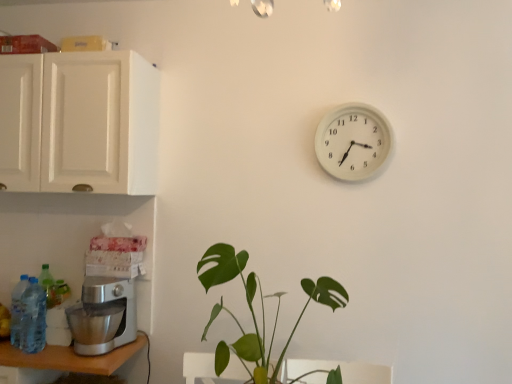
Locate an element on the screen. This screenshot has width=512, height=384. green matte plant at center is located at coordinates (254, 311).

Locate an element on the screen. The width and height of the screenshot is (512, 384). silver metallic table at lower left is located at coordinates (60, 362).

What do you see at coordinates (353, 142) in the screenshot? The width and height of the screenshot is (512, 384). I see `white plastic wall clock at upper right` at bounding box center [353, 142].

The height and width of the screenshot is (384, 512). What do you see at coordinates (33, 318) in the screenshot?
I see `blue plastic bottle at lower left, acting as the 2th bottle starting from the left` at bounding box center [33, 318].

I want to click on white matte cabinet at upper left, so click(79, 122).

Considering the sizes of objects white matte cabinet at upper left and translucent plastic bottle at lower left, the 1th bottle from the left, in the image provided, who is shorter, white matte cabinet at upper left or translucent plastic bottle at lower left, the 1th bottle from the left,?

translucent plastic bottle at lower left, the 1th bottle from the left.

Which of these two, white matte cabinet at upper left or translucent plastic bottle at lower left, positioned as the second bottle in right-to-left order, is smaller?

Smaller between the two is translucent plastic bottle at lower left, positioned as the second bottle in right-to-left order.

From the image's perspective, is white matte cabinet at upper left above or below translucent plastic bottle at lower left, positioned as the second bottle in right-to-left order?

Based on their image positions, white matte cabinet at upper left is located above translucent plastic bottle at lower left, positioned as the second bottle in right-to-left order.

Which point is more distant from viewer, (56, 59) or (24, 304)?

The point (24, 304) is farther from the camera.

From a real-world perspective, is white matte cabinet at upper left below blue plastic bottle at lower left, the 1th bottle viewed from the right?

No, from a real-world perspective, white matte cabinet at upper left is not below blue plastic bottle at lower left, the 1th bottle viewed from the right.

From the picture: Can we say white matte cabinet at upper left lies outside blue plastic bottle at lower left, acting as the 2th bottle starting from the left?

Absolutely, white matte cabinet at upper left is external to blue plastic bottle at lower left, acting as the 2th bottle starting from the left.

Is white matte cabinet at upper left looking in the opposite direction of blue plastic bottle at lower left, acting as the 2th bottle starting from the left?

No, white matte cabinet at upper left is not facing away from blue plastic bottle at lower left, acting as the 2th bottle starting from the left.

From a real-world perspective, is green matte plant at center on translucent plastic bottle at lower left, positioned as the second bottle in right-to-left order?

Correct, in the physical world, green matte plant at center is higher than translucent plastic bottle at lower left, positioned as the second bottle in right-to-left order.

In the scene shown: Relative to translucent plastic bottle at lower left, the 1th bottle from the left, is green matte plant at center in front or behind?

green matte plant at center is in front of translucent plastic bottle at lower left, the 1th bottle from the left.

Is green matte plant at center positioned with its back to translucent plastic bottle at lower left, positioned as the second bottle in right-to-left order?

No, green matte plant at center's orientation is not away from translucent plastic bottle at lower left, positioned as the second bottle in right-to-left order.

Considering the relative sizes of silver metallic table at lower left and white plastic wall clock at upper right in the image provided, is silver metallic table at lower left thinner than white plastic wall clock at upper right?

Incorrect, the width of silver metallic table at lower left is not less than that of white plastic wall clock at upper right.

Is silver metallic table at lower left next to white plastic wall clock at upper right?

No, silver metallic table at lower left is not with white plastic wall clock at upper right.

Based on the photo, considering the relative sizes of silver metallic table at lower left and white plastic wall clock at upper right in the image provided, is silver metallic table at lower left smaller than white plastic wall clock at upper right?

No.

Locate an element on the screen. This screenshot has height=384, width=512. table that appears on the left of white plastic wall clock at upper right is located at coordinates (60, 362).

From the image's perspective, which bottle is the 2nd one above the silver metallic table at lower left? Please provide its 2D coordinates.

[(17, 310)]

From the image's perspective, which object appears higher, translucent plastic bottle at lower left, the 1th bottle from the left, or silver metallic table at lower left?

translucent plastic bottle at lower left, the 1th bottle from the left.

Looking at their sizes, would you say translucent plastic bottle at lower left, positioned as the second bottle in right-to-left order, is wider or thinner than silver metallic table at lower left?

Clearly, translucent plastic bottle at lower left, positioned as the second bottle in right-to-left order, has less width compared to silver metallic table at lower left.

Who is smaller, blue plastic bottle at lower left, acting as the 2th bottle starting from the left, or translucent plastic bottle at lower left, positioned as the second bottle in right-to-left order?

translucent plastic bottle at lower left, positioned as the second bottle in right-to-left order, is smaller.

How much distance is there between blue plastic bottle at lower left, acting as the 2th bottle starting from the left, and translucent plastic bottle at lower left, positioned as the second bottle in right-to-left order?

blue plastic bottle at lower left, acting as the 2th bottle starting from the left, is 1.66 inches from translucent plastic bottle at lower left, positioned as the second bottle in right-to-left order.

Looking at this image, could you tell me if blue plastic bottle at lower left, the 1th bottle viewed from the right, is turned towards translucent plastic bottle at lower left, the 1th bottle from the left?

No.

In the scene shown: Considering the relative positions of blue plastic bottle at lower left, the 1th bottle viewed from the right, and translucent plastic bottle at lower left, positioned as the second bottle in right-to-left order, in the image provided, is blue plastic bottle at lower left, the 1th bottle viewed from the right, to the left of translucent plastic bottle at lower left, positioned as the second bottle in right-to-left order, from the viewer's perspective?

Incorrect, blue plastic bottle at lower left, the 1th bottle viewed from the right, is not on the left side of translucent plastic bottle at lower left, positioned as the second bottle in right-to-left order.

Considering the positions of objects blue plastic bottle at lower left, acting as the 2th bottle starting from the left, and white plastic wall clock at upper right in the image provided, who is more to the left, blue plastic bottle at lower left, acting as the 2th bottle starting from the left, or white plastic wall clock at upper right?

From the viewer's perspective, blue plastic bottle at lower left, acting as the 2th bottle starting from the left, appears more on the left side.

Is blue plastic bottle at lower left, acting as the 2th bottle starting from the left, wider or thinner than white plastic wall clock at upper right?

Considering their sizes, blue plastic bottle at lower left, acting as the 2th bottle starting from the left, looks broader than white plastic wall clock at upper right.

Consider the image. Considering the sizes of objects blue plastic bottle at lower left, the 1th bottle viewed from the right, and white plastic wall clock at upper right in the image provided, who is smaller, blue plastic bottle at lower left, the 1th bottle viewed from the right, or white plastic wall clock at upper right?

With smaller size is blue plastic bottle at lower left, the 1th bottle viewed from the right.

From the image's perspective, is blue plastic bottle at lower left, acting as the 2th bottle starting from the left, located above or below white plastic wall clock at upper right?

Clearly, from the image's perspective, blue plastic bottle at lower left, acting as the 2th bottle starting from the left, is below white plastic wall clock at upper right.

Identify the location of cabinetry on the right of translucent plastic bottle at lower left, positioned as the second bottle in right-to-left order. (79, 122).

I want to click on the 1st bottle behind the white matte cabinet at upper left, counting from the anchor's position, so click(33, 318).

When comparing their distances from silver metallic table at lower left, does satin silver mixer at lower left or green matte plant at center seem closer?

The object closer to silver metallic table at lower left is satin silver mixer at lower left.

Considering their positions, is white plastic wall clock at upper right positioned closer to satin silver mixer at lower left than silver metallic table at lower left?

Based on the image, silver metallic table at lower left appears to be nearer to satin silver mixer at lower left.

Looking at the image, which one is located further to white matte cabinet at upper left, satin silver mixer at lower left or translucent plastic bottle at lower left, the 1th bottle from the left?

Based on the image, translucent plastic bottle at lower left, the 1th bottle from the left, appears to be further to white matte cabinet at upper left.

Considering their positions, is satin silver mixer at lower left positioned further to white matte cabinet at upper left than silver metallic table at lower left?

Among the two, silver metallic table at lower left is located further to white matte cabinet at upper left.

Based on their spatial positions, is white plastic wall clock at upper right or white matte cabinet at upper left further from silver metallic table at lower left?

white plastic wall clock at upper right lies further to silver metallic table at lower left than the other object.

From the picture: Estimate the real-world distances between objects in this image. Which object is closer to translucent plastic bottle at lower left, the 1th bottle from the left, silver metallic table at lower left or white matte cabinet at upper left?

silver metallic table at lower left is closer to translucent plastic bottle at lower left, the 1th bottle from the left.

From the image, which object appears to be nearer to white plastic wall clock at upper right, satin silver mixer at lower left or silver metallic table at lower left?

satin silver mixer at lower left is closer to white plastic wall clock at upper right.

From the picture: From the image, which object appears to be nearer to satin silver mixer at lower left, white matte cabinet at upper left or silver metallic table at lower left?

Based on the image, silver metallic table at lower left appears to be nearer to satin silver mixer at lower left.

Locate an element on the screen. coffee maker situated between white matte cabinet at upper left and green matte plant at center from left to right is located at coordinates (105, 308).

Locate an element on the screen. The height and width of the screenshot is (384, 512). coffee maker between white matte cabinet at upper left and silver metallic table at lower left in the up-down direction is located at coordinates [105, 308].

Where is `houseplant between white matte cabinet at upper left and white plastic wall clock at upper right`? houseplant between white matte cabinet at upper left and white plastic wall clock at upper right is located at coordinates (254, 311).

At what (x,y) coordinates should I click in order to perform the action: click on cabinetry located between blue plastic bottle at lower left, acting as the 2th bottle starting from the left, and green matte plant at center in the left-right direction. Please return your answer as a coordinate pair (x, y). The image size is (512, 384). Looking at the image, I should click on (79, 122).